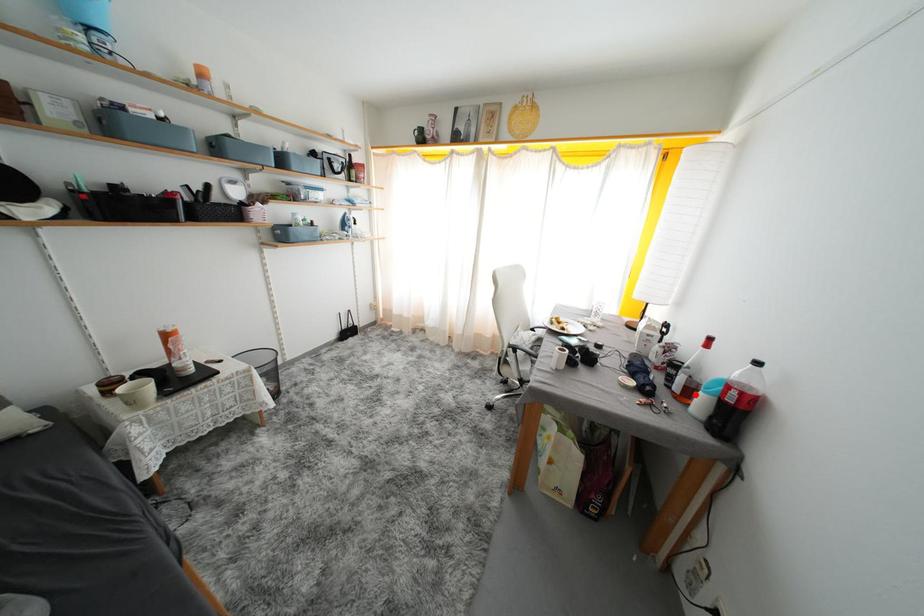
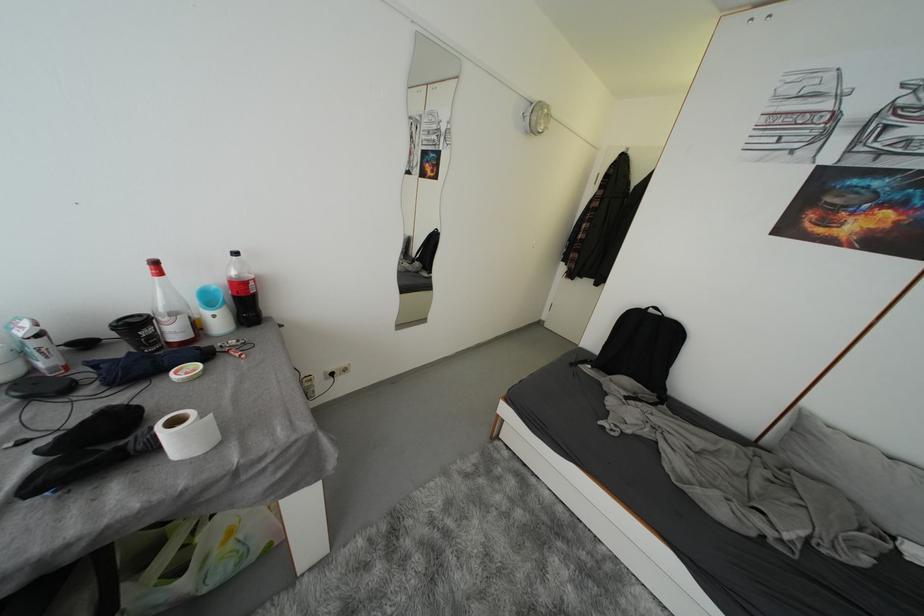
In the second image, find the point that corresponds to the highlighted location in the first image.

(202, 329)